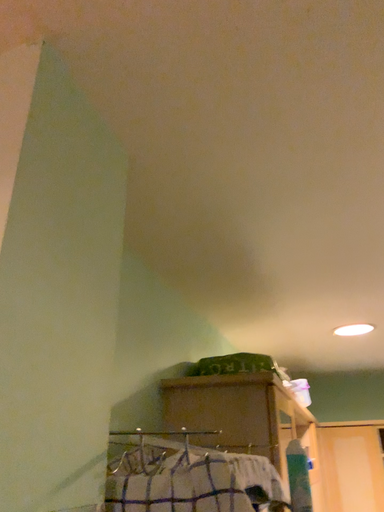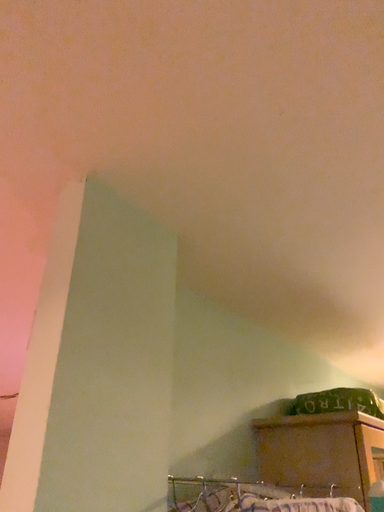
Question: How did the camera likely rotate when shooting the video?

Choices:
 (A) rotated left
 (B) rotated right

Answer: (A)